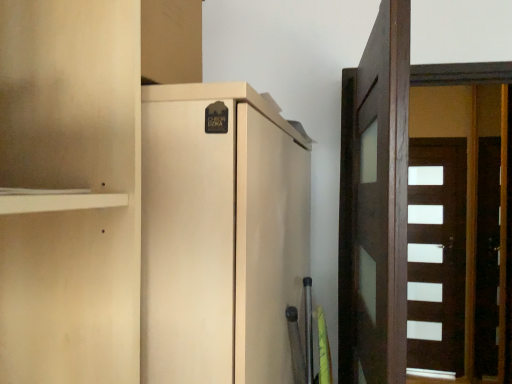
The height and width of the screenshot is (384, 512). What do you see at coordinates (140, 210) in the screenshot? I see `matte beige cupboard at center` at bounding box center [140, 210].

This screenshot has height=384, width=512. What are the coordinates of `dark brown wood door at right, acting as the 2th door starting from the back` in the screenshot? It's located at (375, 205).

I want to click on white glossy door at right, acting as the first door starting from the back, so click(436, 256).

Which object is closer to the camera, matte beige cupboard at center or dark brown wood door at right, the first door from the left?

matte beige cupboard at center is in front.

Looking at this image, from a real-world perspective, who is located higher, matte beige cupboard at center or dark brown wood door at right, acting as the 2th door starting from the back?

From a 3D spatial view, dark brown wood door at right, acting as the 2th door starting from the back, is above.

How different are the orientations of matte beige cupboard at center and dark brown wood door at right, acting as the 2th door starting from the back, in degrees?

84 degrees separate the facing orientations of matte beige cupboard at center and dark brown wood door at right, acting as the 2th door starting from the back.

Which is more to the left, matte beige cupboard at center or dark brown wood door at right, the first door from the left?

matte beige cupboard at center.

How far apart are dark brown wood door at right, which is the second door from right to left, and white glossy door at right, the 1th door in the right-to-left sequence?

dark brown wood door at right, which is the second door from right to left, is 2.74 meters from white glossy door at right, the 1th door in the right-to-left sequence.

Is dark brown wood door at right, which is the second door from right to left, taller or shorter than white glossy door at right, the 1th door in the right-to-left sequence?

In the image, dark brown wood door at right, which is the second door from right to left, appears to be shorter than white glossy door at right, the 1th door in the right-to-left sequence.

Is dark brown wood door at right, acting as the 2th door starting from the back, facing towards white glossy door at right, acting as the first door starting from the back?

No, dark brown wood door at right, acting as the 2th door starting from the back, is not facing towards white glossy door at right, acting as the first door starting from the back.

Based on the photo, from the image's perspective, is dark brown wood door at right, which is the second door from right to left, under white glossy door at right, the 2th door in the front-to-back sequence?

No, from the image's perspective, dark brown wood door at right, which is the second door from right to left, is not beneath white glossy door at right, the 2th door in the front-to-back sequence.

Considering the relative sizes of white glossy door at right, acting as the first door starting from the back, and dark brown wood door at right, which is the second door from right to left, in the image provided, is white glossy door at right, acting as the first door starting from the back, thinner than dark brown wood door at right, which is the second door from right to left,?

Yes, white glossy door at right, acting as the first door starting from the back, is thinner than dark brown wood door at right, which is the second door from right to left.

Looking at this image, is dark brown wood door at right, the first door from the left, surrounded by white glossy door at right, which ranks as the second door in left-to-right order?

Definitely not — dark brown wood door at right, the first door from the left, is not inside white glossy door at right, which ranks as the second door in left-to-right order.

From the image's perspective, which is above, white glossy door at right, the 1th door in the right-to-left sequence, or dark brown wood door at right, the first door from the left?

dark brown wood door at right, the first door from the left.

Where is `door in front of the white glossy door at right, which ranks as the second door in left-to-right order`? This screenshot has height=384, width=512. door in front of the white glossy door at right, which ranks as the second door in left-to-right order is located at coordinates (375, 205).

Where is `the 2nd door counting from the right of the matte beige cupboard at center`? This screenshot has width=512, height=384. the 2nd door counting from the right of the matte beige cupboard at center is located at coordinates (436, 256).

Considering the positions of objects matte beige cupboard at center and white glossy door at right, the 2th door in the front-to-back sequence, in the image provided, who is behind, matte beige cupboard at center or white glossy door at right, the 2th door in the front-to-back sequence,?

Positioned behind is white glossy door at right, the 2th door in the front-to-back sequence.

From the image's perspective, which is below, matte beige cupboard at center or white glossy door at right, the 2th door in the front-to-back sequence?

white glossy door at right, the 2th door in the front-to-back sequence, from the image's perspective.

Measure the distance from matte beige cupboard at center to white glossy door at right, acting as the first door starting from the back.

matte beige cupboard at center is 3.43 meters from white glossy door at right, acting as the first door starting from the back.

Is there a large distance between white glossy door at right, the 1th door in the right-to-left sequence, and matte beige cupboard at center?

Yes, white glossy door at right, the 1th door in the right-to-left sequence, and matte beige cupboard at center are quite far apart.

Is white glossy door at right, which ranks as the second door in left-to-right order, looking in the opposite direction of matte beige cupboard at center?

No, white glossy door at right, which ranks as the second door in left-to-right order, is not facing away from matte beige cupboard at center.

Can you tell me how much white glossy door at right, the 1th door in the right-to-left sequence, and matte beige cupboard at center differ in facing direction?

They differ by 91.5 degrees in their facing directions.

Which is nearer, (428,222) or (242,203)?

Clearly, point (428,222) is more distant from the camera than point (242,203).

From a real-world perspective, is dark brown wood door at right, placed as the first door when sorted from front to back, physically below matte beige cupboard at center?

No, from a real-world perspective, dark brown wood door at right, placed as the first door when sorted from front to back, is not below matte beige cupboard at center.

Is point (384, 56) farther from camera compared to point (22, 237)?

Yes, it is behind point (22, 237).

Which object is further away from the camera taking this photo, dark brown wood door at right, placed as the first door when sorted from front to back, or matte beige cupboard at center?

dark brown wood door at right, placed as the first door when sorted from front to back, is behind.

Does dark brown wood door at right, placed as the first door when sorted from front to back, touch matte beige cupboard at center?

No, dark brown wood door at right, placed as the first door when sorted from front to back, is not making contact with matte beige cupboard at center.

The image size is (512, 384). Find the location of `cupboard below the dark brown wood door at right, which is the second door from right to left (from a real-world perspective)`. cupboard below the dark brown wood door at right, which is the second door from right to left (from a real-world perspective) is located at coordinates (140, 210).

You are a GUI agent. You are given a task and a screenshot of the screen. Output one action in this format:
    pyautogui.click(x=<x>, y=<y>)
    Task: Click on the door that is on the left side of white glossy door at right, the 1th door in the right-to-left sequence
    The image size is (512, 384).
    Given the screenshot: What is the action you would take?
    pyautogui.click(x=375, y=205)

Which object lies nearer to the anchor point matte beige cupboard at center, dark brown wood door at right, placed as the first door when sorted from front to back, or white glossy door at right, acting as the first door starting from the back?

dark brown wood door at right, placed as the first door when sorted from front to back, is positioned closer to the anchor matte beige cupboard at center.

Which object lies further to the anchor point dark brown wood door at right, acting as the 2th door starting from the back, matte beige cupboard at center or white glossy door at right, which ranks as the second door in left-to-right order?

white glossy door at right, which ranks as the second door in left-to-right order, is positioned further to the anchor dark brown wood door at right, acting as the 2th door starting from the back.

Looking at the image, which one is located further to white glossy door at right, acting as the first door starting from the back, dark brown wood door at right, placed as the first door when sorted from front to back, or matte beige cupboard at center?

Based on the image, matte beige cupboard at center appears to be further to white glossy door at right, acting as the first door starting from the back.

In the scene shown: Considering their positions, is white glossy door at right, the 1th door in the right-to-left sequence, positioned further to dark brown wood door at right, acting as the 2th door starting from the back, than matte beige cupboard at center?

white glossy door at right, the 1th door in the right-to-left sequence, is further to dark brown wood door at right, acting as the 2th door starting from the back.

Looking at the image, which one is located closer to white glossy door at right, the 1th door in the right-to-left sequence, matte beige cupboard at center or dark brown wood door at right, acting as the 2th door starting from the back?

dark brown wood door at right, acting as the 2th door starting from the back, is positioned closer to the anchor white glossy door at right, the 1th door in the right-to-left sequence.

Looking at the image, which one is located closer to matte beige cupboard at center, white glossy door at right, the 2th door in the front-to-back sequence, or dark brown wood door at right, acting as the 2th door starting from the back?

Among the two, dark brown wood door at right, acting as the 2th door starting from the back, is located nearer to matte beige cupboard at center.

Where is `door between matte beige cupboard at center and white glossy door at right, the 2th door in the front-to-back sequence, from front to back`? This screenshot has width=512, height=384. door between matte beige cupboard at center and white glossy door at right, the 2th door in the front-to-back sequence, from front to back is located at coordinates (375, 205).